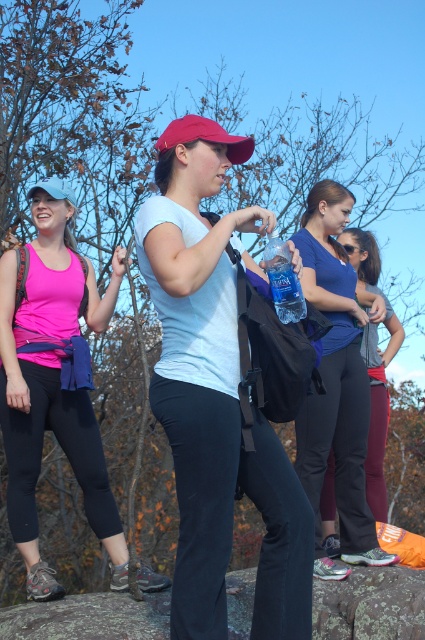
Who is taller, matte white shirt at center or blue fabric tank top at center?

Standing taller between the two is blue fabric tank top at center.

Which is in front, point (175, 285) or point (336, 358)?

Point (175, 285) is in front.

Identify the location of matte white shirt at center. (215, 396).

Who is higher up, pink fabric tank top at left or clear plastic bottle at center?

clear plastic bottle at center is higher up.

Does pink fabric tank top at left lie in front of clear plastic bottle at center?

No.

Is point (45, 380) less distant than point (278, 282)?

No, it is not.

The height and width of the screenshot is (640, 425). What are the coordinates of `pink fabric tank top at left` in the screenshot? It's located at (53, 384).

Between pink fabric tank top at left and blue fabric tank top at center, which one has more height?

blue fabric tank top at center

Can you confirm if pink fabric tank top at left is bigger than blue fabric tank top at center?

No, pink fabric tank top at left is not bigger than blue fabric tank top at center.

You are a GUI agent. You are given a task and a screenshot of the screen. Output one action in this format:
    pyautogui.click(x=<x>, y=<y>)
    Task: Click on the pink fabric tank top at left
    The height and width of the screenshot is (640, 425).
    Given the screenshot: What is the action you would take?
    pyautogui.click(x=53, y=384)